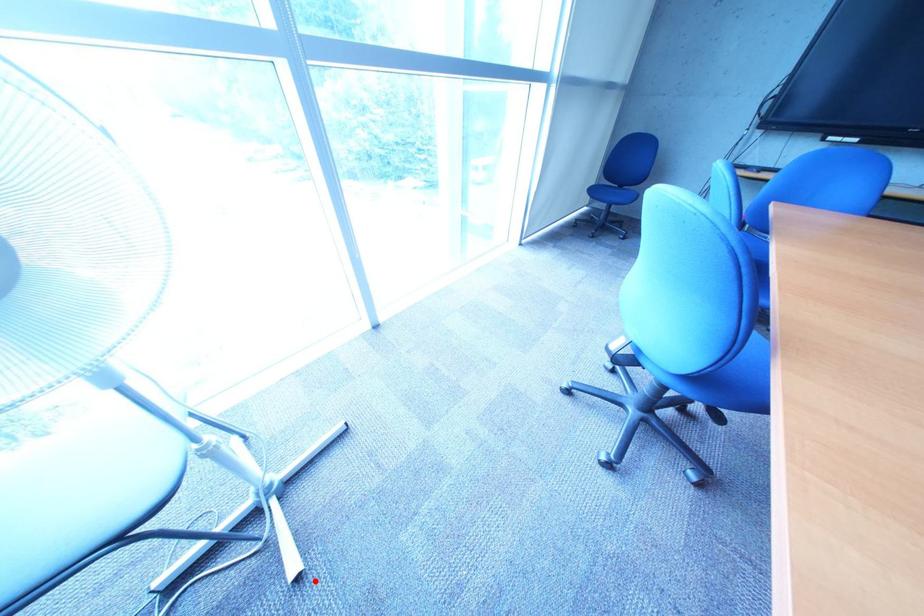
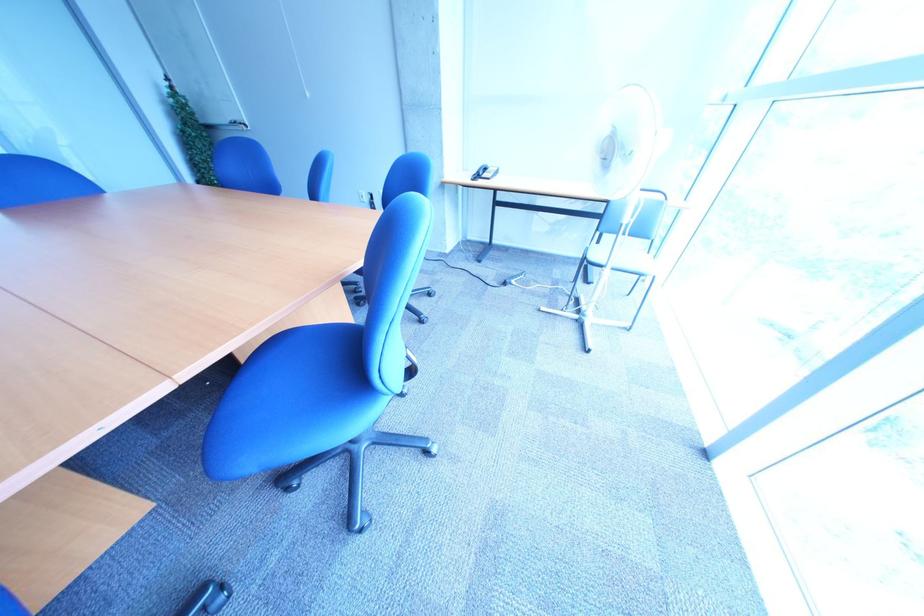
Where in the second image is the point corresponding to the highlighted location from the first image?

(554, 312)